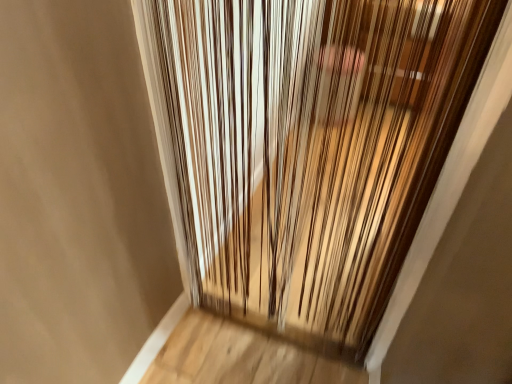
In order to face metallic thread curtain at center, should I rotate leftwards or rightwards?

It's best to rotate right around 4.301 degrees.

Image resolution: width=512 pixels, height=384 pixels. Describe the element at coordinates (305, 146) in the screenshot. I see `metallic thread curtain at center` at that location.

Where is `metallic thread curtain at center`? metallic thread curtain at center is located at coordinates (305, 146).

At what (x,y) coordinates should I click in order to perform the action: click on metallic thread curtain at center. Please return your answer as a coordinate pair (x, y). Looking at the image, I should click on (305, 146).